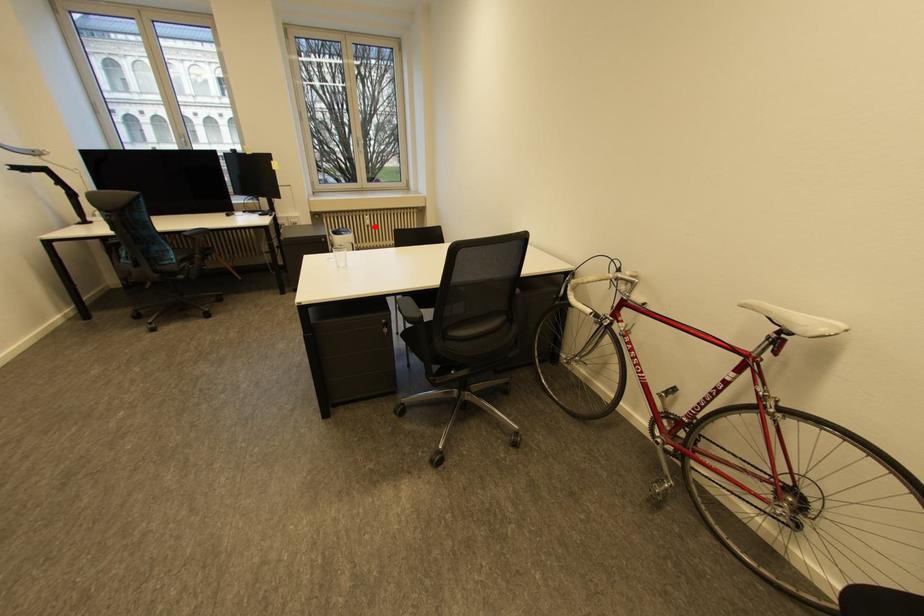
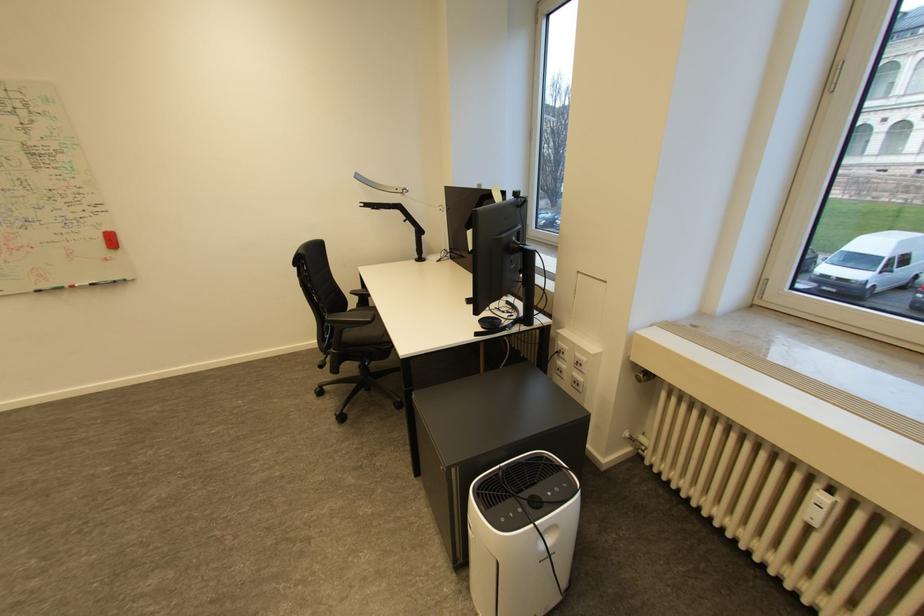
Find the pixel in the second image that matches the highlighted location in the first image.

(816, 525)